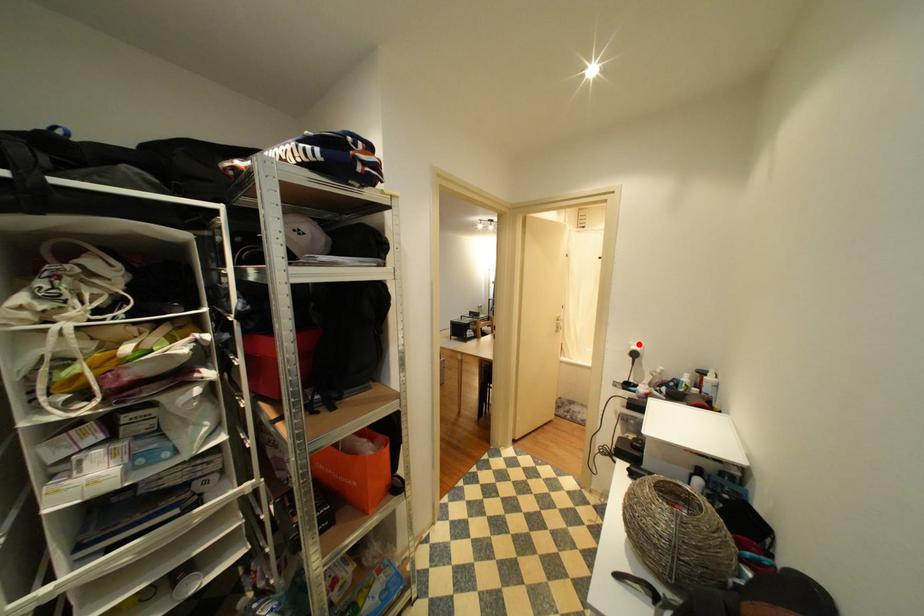
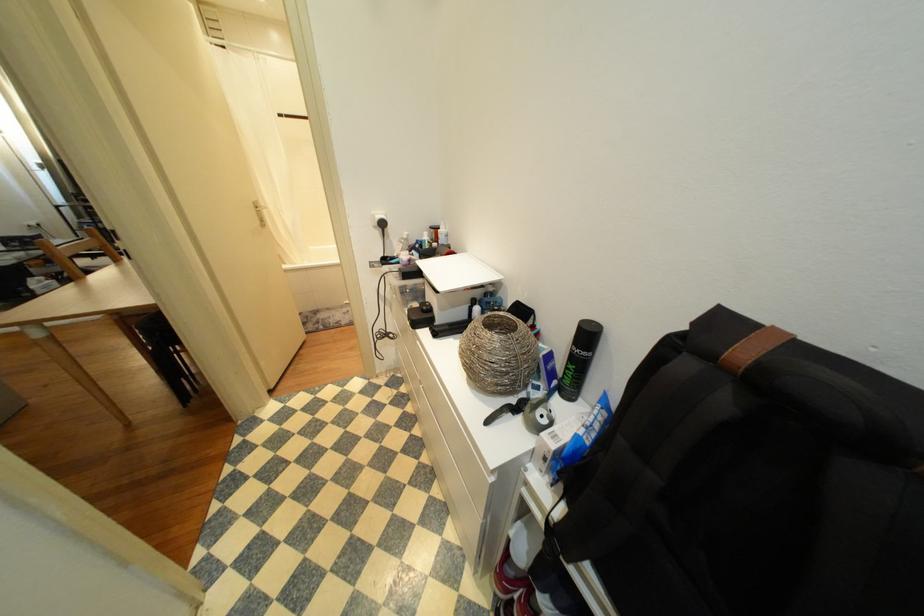
Question: A red point is marked in image1. In image2, is the corresponding 3D point closer to the camera or farther? Reply with the corresponding letter.

Choices:
 (A) The corresponding 3D point is closer.
 (B) The corresponding 3D point is farther.

Answer: (A)